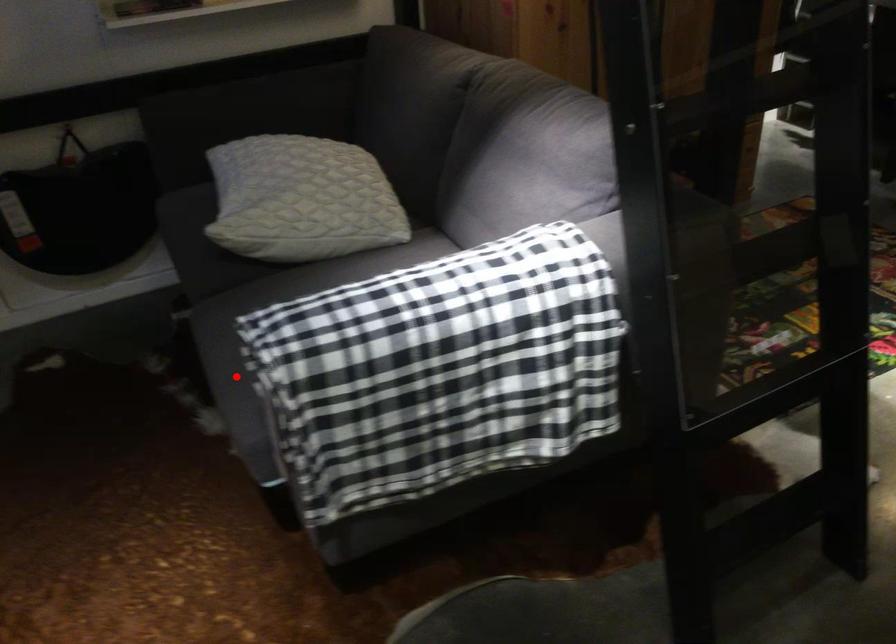
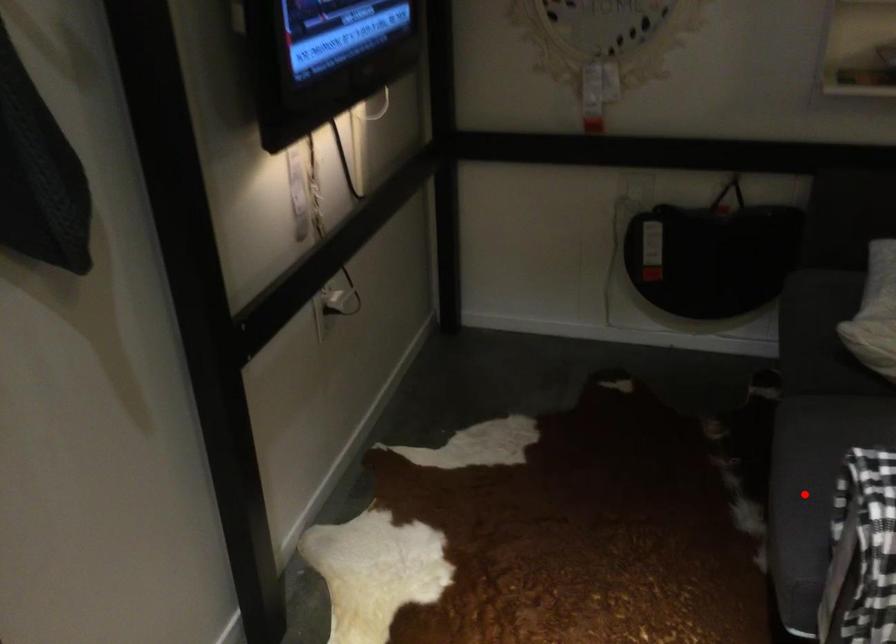
I am providing you with two images of the same scene from different viewpoints. A red point is marked on the first image and another point is marked on the second image. Are the points marked in image1 and image2 representing the same 3D position?

Yes